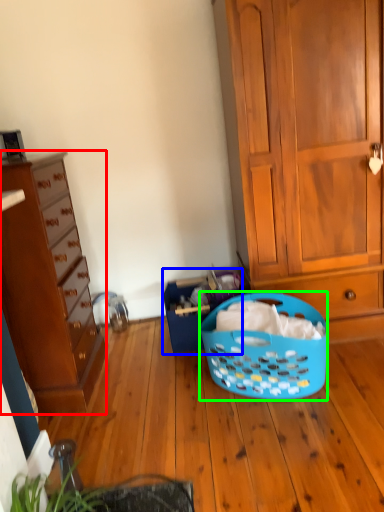
Question: Based on their relative distances, which object is nearer to cabinetry (highlighted by a red box)? Choose from shopping basket (highlighted by a blue box) and picnic basket (highlighted by a green box).

Choices:
 (A) shopping basket
 (B) picnic basket

Answer: (A)